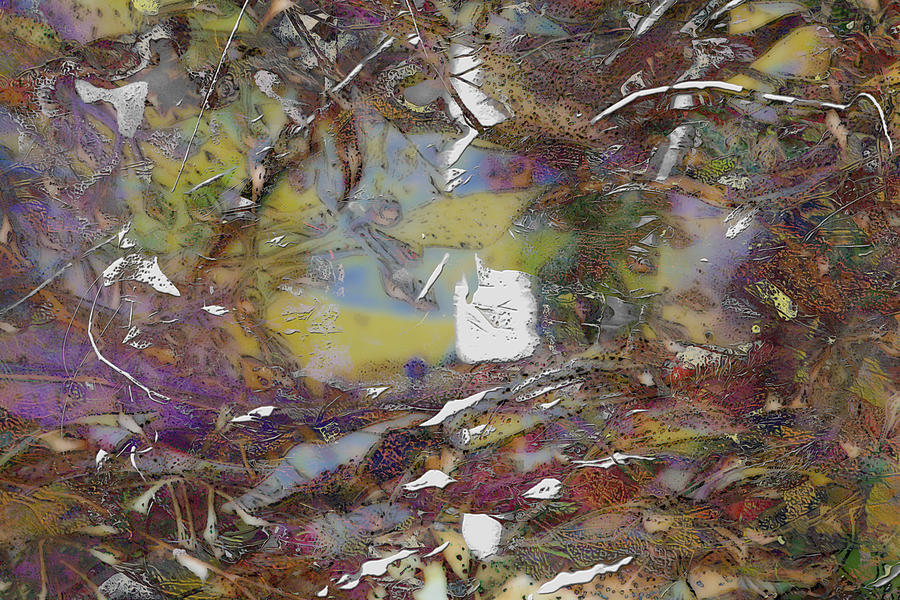
Where is `top left edge of painting`? This screenshot has height=600, width=900. top left edge of painting is located at coordinates (2, 1).